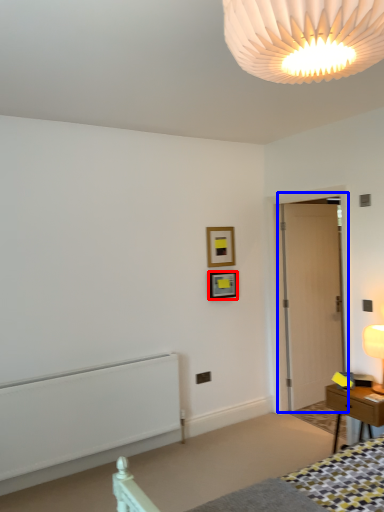
Question: Which object appears farthest to the camera in this image, picture frame (highlighted by a red box) or door (highlighted by a blue box)?

Choices:
 (A) picture frame
 (B) door

Answer: (A)